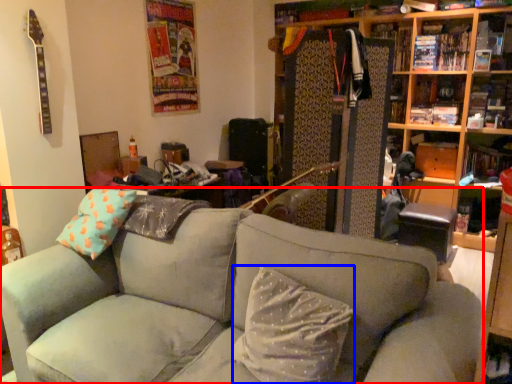
Question: Which of the following is the farthest to the observer, studio couch (highlighted by a red box) or pillow (highlighted by a blue box)?

Choices:
 (A) studio couch
 (B) pillow

Answer: (B)